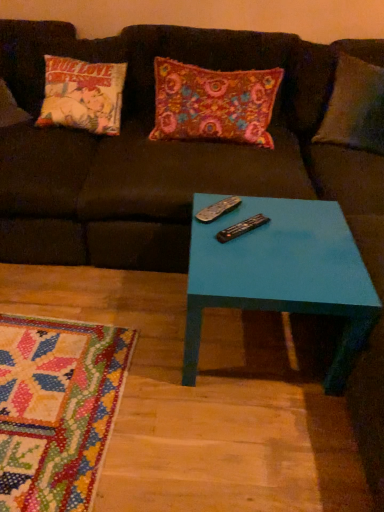
This screenshot has height=512, width=384. I want to click on free spot to the left of teal glossy table at center, so click(121, 341).